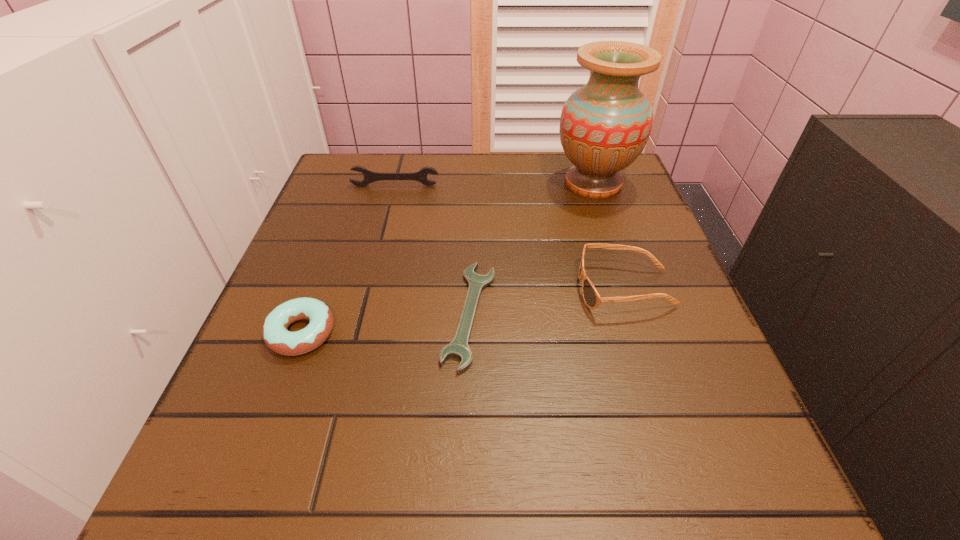
This screenshot has height=540, width=960. Identify the location of vacant space located 0.260m on the front-facing side of the sunglasses. (439, 289).

Locate an element on the screen. The image size is (960, 540). free space located 0.180m on the open ends of the taller wrench is located at coordinates (383, 233).

In order to click on free space located 0.080m on the right of the fourth tallest object in this screenshot , I will do (x=383, y=333).

Image resolution: width=960 pixels, height=540 pixels. What are the coordinates of `free space located on the front of the third object from left to right` in the screenshot? It's located at point(468,416).

This screenshot has height=540, width=960. I want to click on vase positioned at the far edge, so coord(604,126).

You are a GUI agent. You are given a task and a screenshot of the screen. Output one action in this format:
    pyautogui.click(x=<x>, y=<y>)
    Task: Click on the wrench located in the far edge section of the desktop
    This screenshot has height=540, width=960.
    Given the screenshot: What is the action you would take?
    pyautogui.click(x=370, y=176)

Find the location of `wrench that is at the left edge`. wrench that is at the left edge is located at coordinates (370, 176).

This screenshot has width=960, height=540. What are the coordinates of `doughnut that is positioned at the left edge` in the screenshot? It's located at (276, 336).

I want to click on vase that is at the right edge, so click(x=604, y=126).

Find the location of a particular element. sunglasses that is positioned at the right edge is located at coordinates (592, 299).